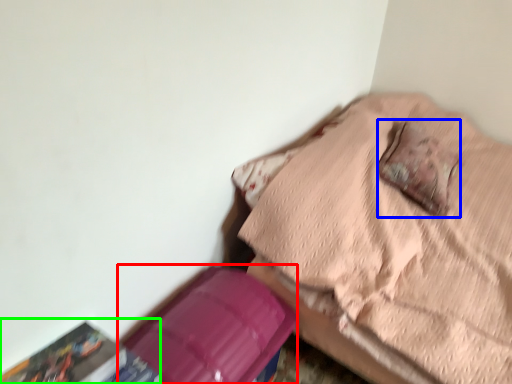
Question: Based on their relative distances, which object is farther from cardboard box (highlighted by a red box)? Choose from pillow (highlighted by a blue box) and paperback book (highlighted by a green box).

Choices:
 (A) pillow
 (B) paperback book

Answer: (A)